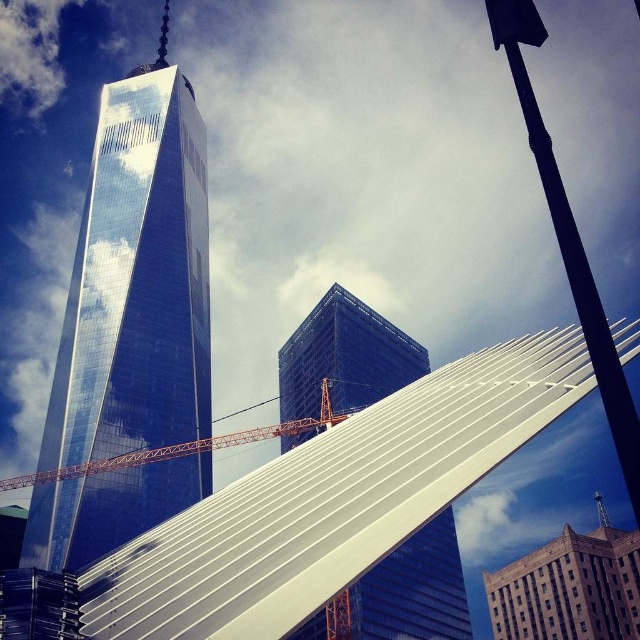
Question: Is dark blue glass skyscraper at center behind orange metallic crane at center?

Choices:
 (A) no
 (B) yes

Answer: (A)

Question: Considering the real-world distances, which object is farthest from the shiny glass skyscraper at center?

Choices:
 (A) dark blue glass skyscraper at center
 (B) orange metallic crane at center

Answer: (A)

Question: Among these points, which one is farthest from the camera?

Choices:
 (A) (296, 424)
 (B) (186, 230)

Answer: (B)

Question: Which point is closer to the camera taking this photo?

Choices:
 (A) (440, 579)
 (B) (192, 308)

Answer: (A)

Question: From the image, what is the correct spatial relationship of shiny glass skyscraper at center in relation to dark blue glass skyscraper at center?

Choices:
 (A) right
 (B) left

Answer: (B)

Question: Does dark blue glass skyscraper at center appear on the right side of orange metallic crane at center?

Choices:
 (A) no
 (B) yes

Answer: (B)